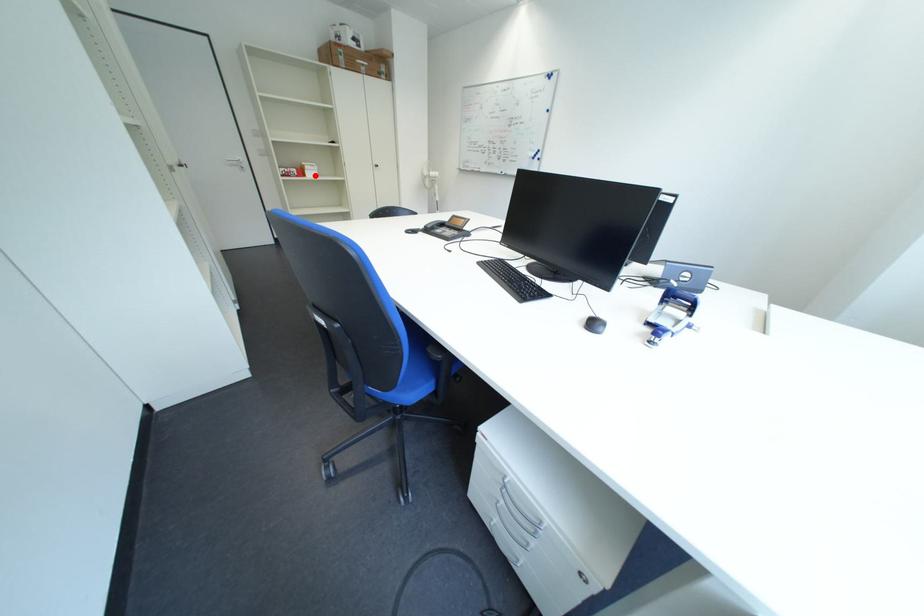
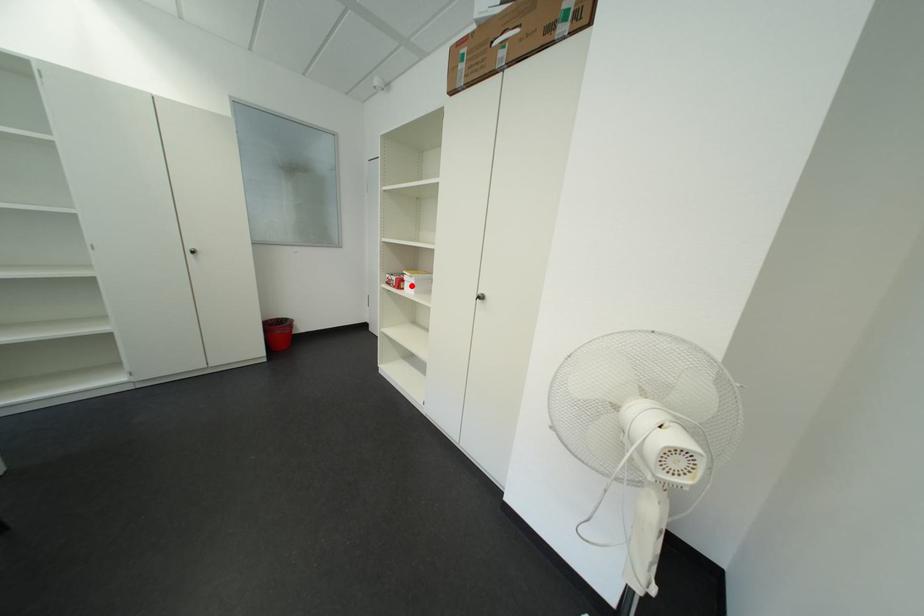
I am providing you with two images of the same scene from different viewpoints. A red point is marked on the first image and another point is marked on the second image. Is the marked point in image1 the same physical position as the marked point in image2?

Yes